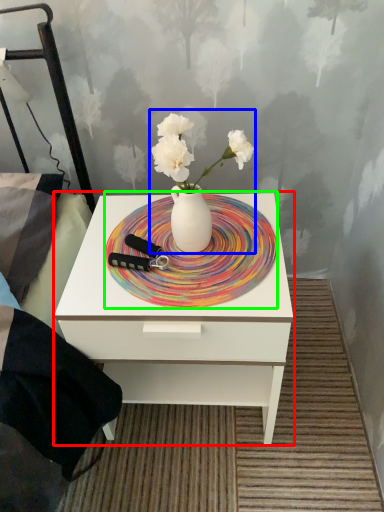
Question: Which object is the farthest from nightstand (highlighted by a red box)? Choose among these: floral arrangement (highlighted by a blue box) or plate (highlighted by a green box).

Choices:
 (A) floral arrangement
 (B) plate

Answer: (A)